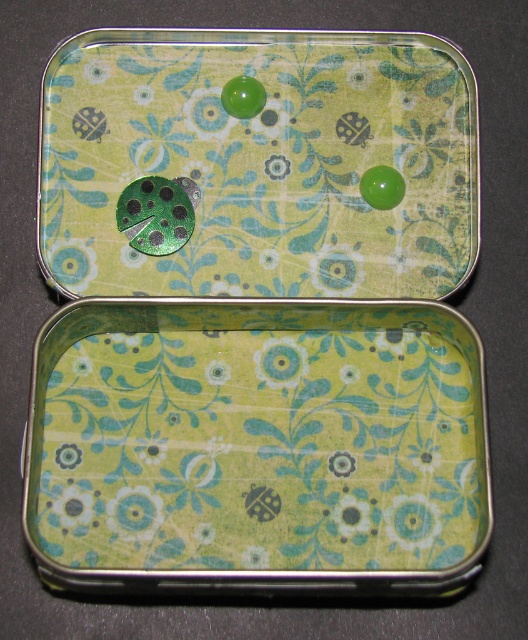
Question: Among these objects, which one is nearest to the camera?

Choices:
 (A) green floral-patterned tray at center
 (B) green matte ladybug at upper center

Answer: (A)

Question: Does green floral-patterned tray at center lie behind green matte ladybug at upper center?

Choices:
 (A) no
 (B) yes

Answer: (A)

Question: Which object appears closest to the camera in this image?

Choices:
 (A) green matte ladybug at upper center
 (B) green floral-patterned tray at center

Answer: (B)

Question: Can you confirm if green floral-patterned tray at center is smaller than green matte ladybug at upper center?

Choices:
 (A) yes
 (B) no

Answer: (B)

Question: Is green floral-patterned tray at center thinner than green matte ladybug at upper center?

Choices:
 (A) no
 (B) yes

Answer: (B)